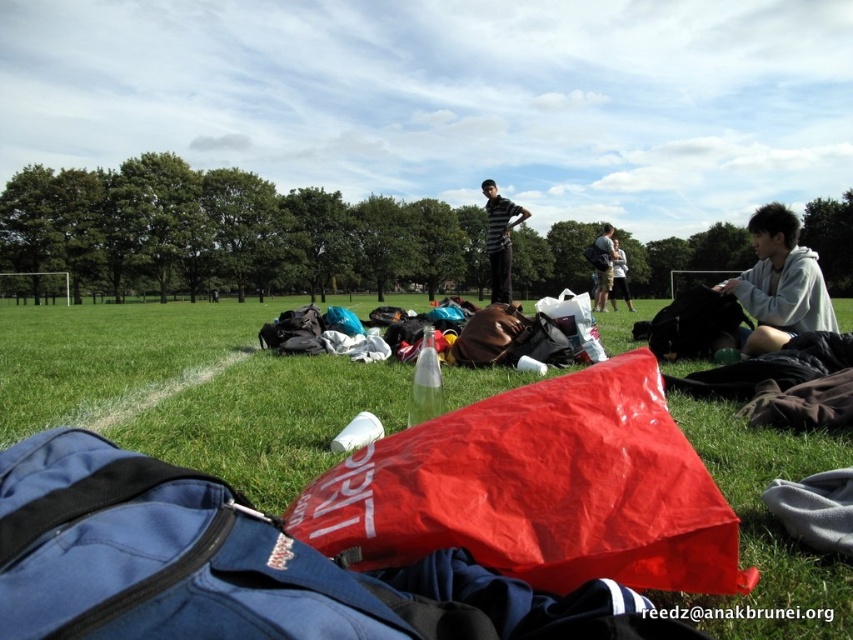
You are standing in the park and want to place a picnic blanket. The coordinates for the green grass at center are given. Is this area suitable for placing the blanket?

The green grass at center is located at point (189,388), so yes, this area is suitable for placing the picnic blanket as it is on the grass.

You are a photographer aiming to capture a wide shot of the striped fabric shirt at center and the matte black backpack at center. Given that your camera can only focus on objects within a 1.5 meter width, will both items fit within the frame?

The striped fabric shirt at center is wider than the matte black backpack at center. However, since the total width of both items combined may exceed 1.5 meters, it depends on their exact positions. The description only states the shirt is wider, not the total combined width.

You are planning to place a small picnic basket on the green grass at center. Considering the height of the matte black backpack at center, will the basket be visible once placed there?

The green grass at center is shorter than the matte black backpack at center, so the picnic basket placed on the green grass at center will be visible as it won